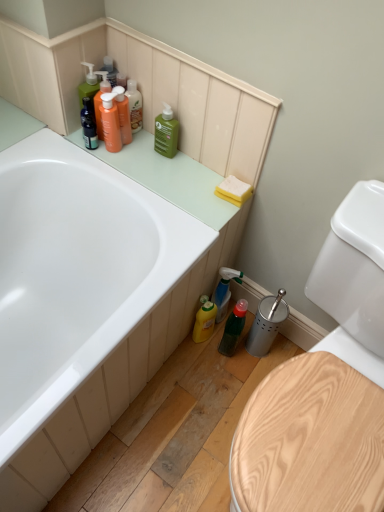
The height and width of the screenshot is (512, 384). I want to click on vacant space in front of translucent orange bottles at upper left, arranged as the 1th toiletry when ordered from the bottom, so click(x=125, y=172).